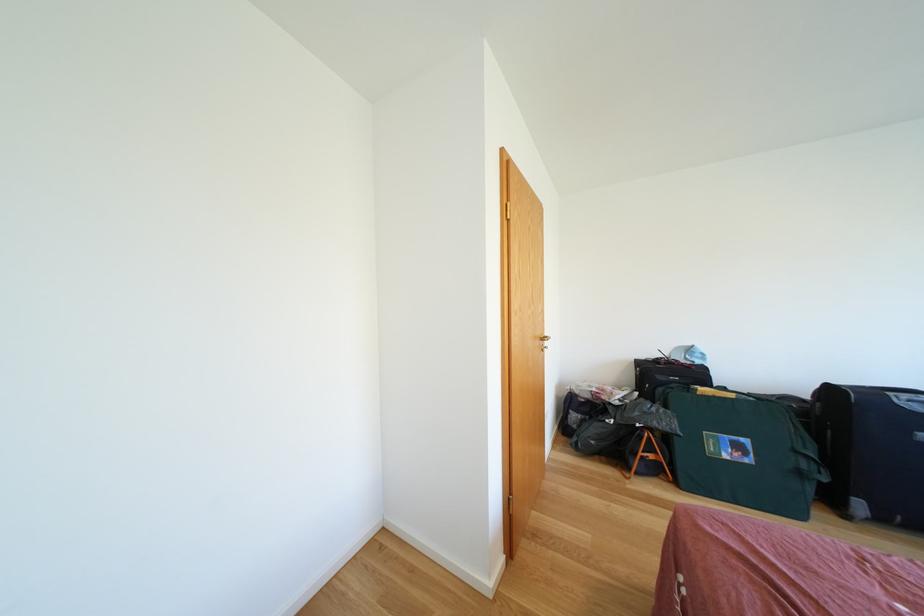
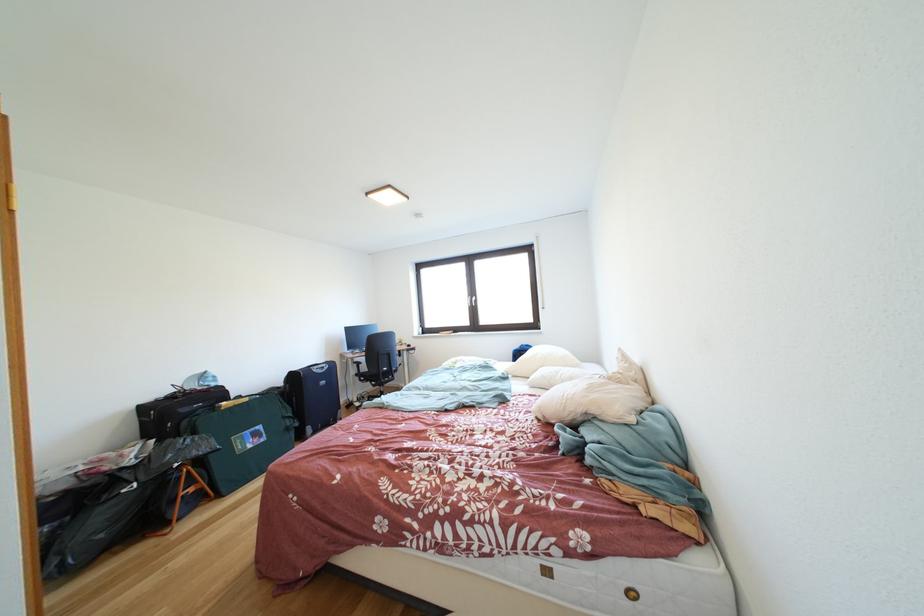
In the second image, find the point that corresponds to point (832, 484) in the first image.

(306, 429)